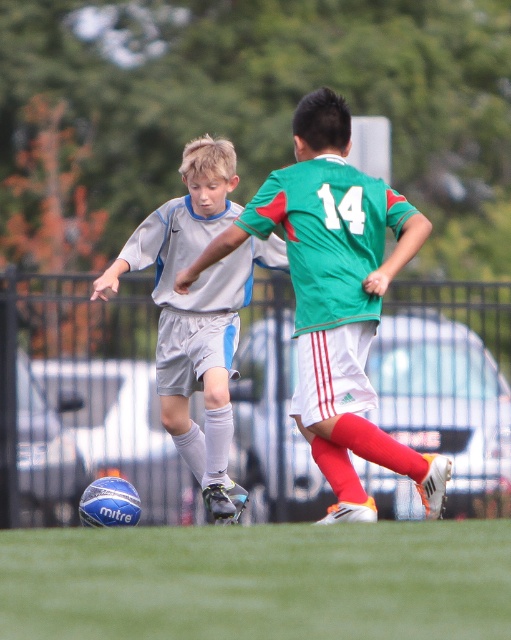
You are a soccer coach observing the match. You notice the green grass at center and the green jersey at center. Which one is taller?

The green grass at center is not as tall as the green jersey at center, so the green jersey at center is taller.

You are a soccer coach observing the match. You notice the matte white soccer ball at lower left and the green grass at center. Which object is closer to the camera?

The green grass at center is in front of the matte white soccer ball at lower left, so the green grass at center is closer to the camera.

You are a soccer coach observing the match. You notice the green grass at center and the green jersey at center. Which one is positioned more to the left?

The green grass at center is positioned to the left of the green jersey at center, so the green grass at center is more to the left.